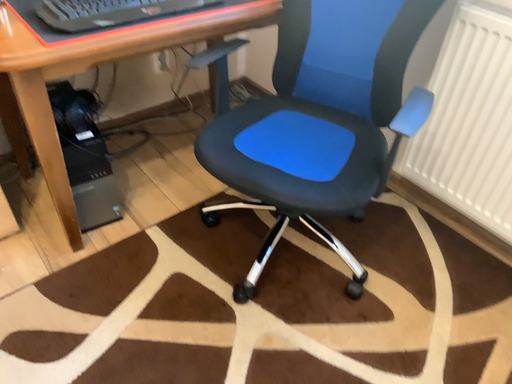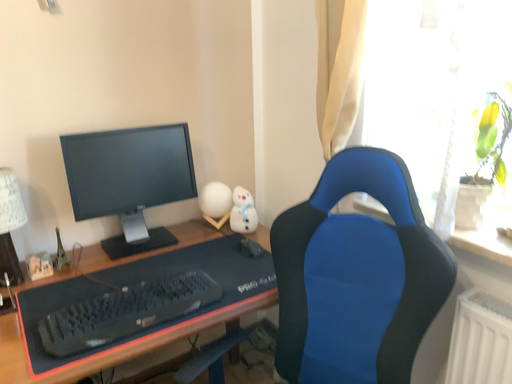
Question: How did the camera likely rotate when shooting the video?

Choices:
 (A) rotated upward
 (B) rotated downward

Answer: (A)